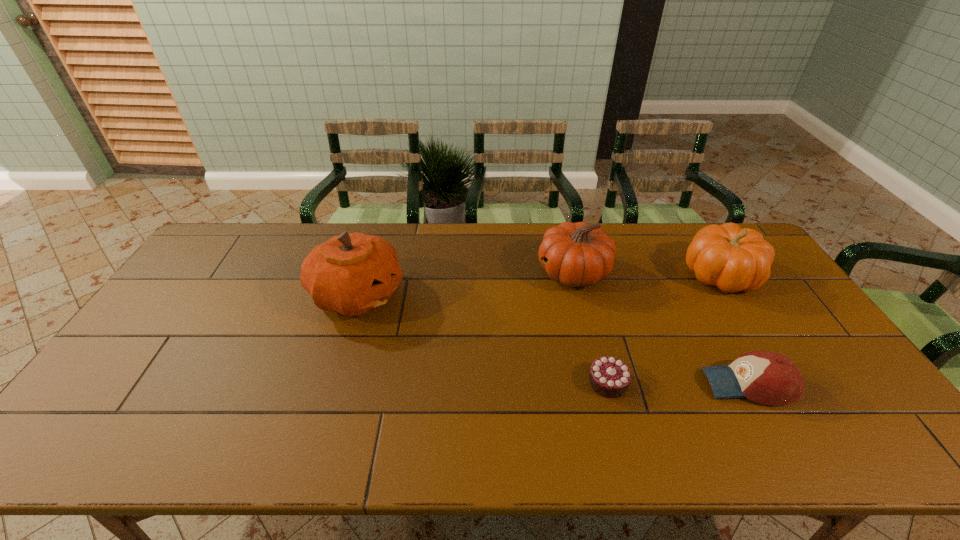
This screenshot has width=960, height=540. I want to click on vacant space at the right edge of the desktop, so click(x=767, y=305).

The height and width of the screenshot is (540, 960). What are the coordinates of `vacant space at the far left corner` in the screenshot? It's located at (235, 224).

At what (x,y) coordinates should I click in order to perform the action: click on free space at the near left corner of the desktop. Please return your answer as a coordinate pair (x, y). The image size is (960, 540). Looking at the image, I should click on (117, 455).

Locate an element on the screen. free area in between the tallest object and the shortest object is located at coordinates (483, 339).

Locate an element on the screen. free space between the chocolate cake and the rightmost pumpkin is located at coordinates (664, 328).

Where is `free space between the chocolate cake and the second pumpkin from right to left`? The image size is (960, 540). free space between the chocolate cake and the second pumpkin from right to left is located at coordinates (590, 327).

Locate an element on the screen. The height and width of the screenshot is (540, 960). free space between the leftmost pumpkin and the rightmost pumpkin is located at coordinates (539, 285).

Find the location of a particular element. The width and height of the screenshot is (960, 540). free area in between the leftmost pumpkin and the rightmost pumpkin is located at coordinates (539, 285).

Locate an element on the screen. empty location between the leftmost pumpkin and the shortest object is located at coordinates (483, 339).

Where is `vacant area that lies between the shortest object and the second pumpkin from left to right`? The height and width of the screenshot is (540, 960). vacant area that lies between the shortest object and the second pumpkin from left to right is located at coordinates (590, 327).